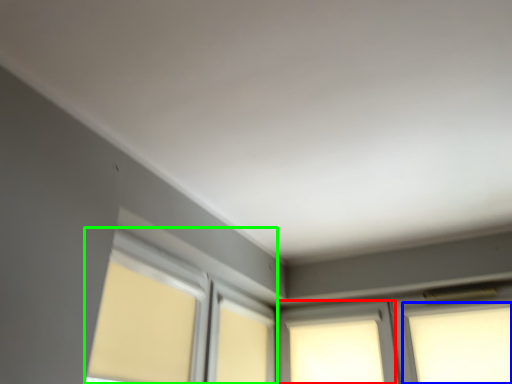
Question: Which object is positioned closest to window (highlighted by a red box)? Select from window (highlighted by a blue box) and bay window (highlighted by a green box).

Choices:
 (A) window
 (B) bay window

Answer: (A)